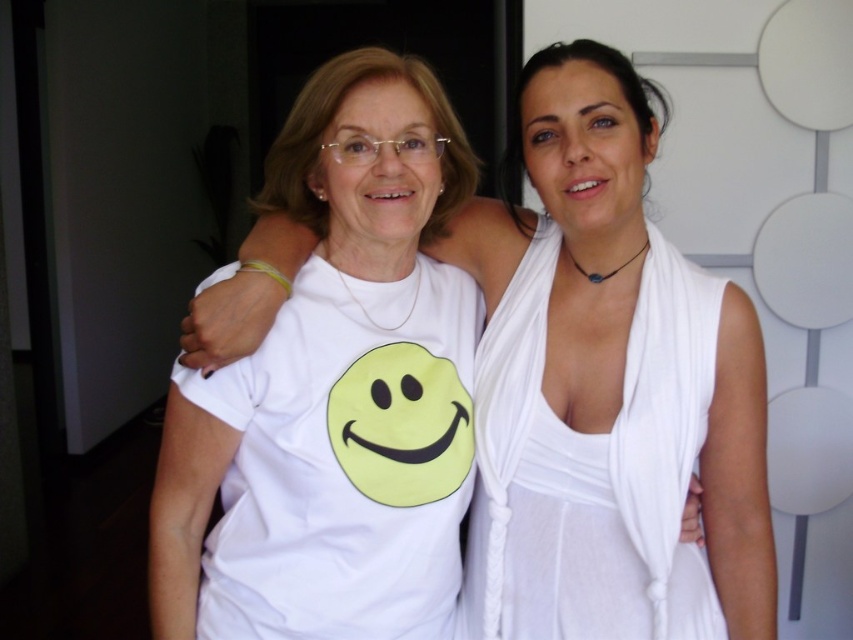
You are a photographer positioned in front of the two women. You want to take a photo that focuses on the white fabric dress at center and the white silky dress at center. Which dress will appear larger in the photo?

The white fabric dress at center will appear larger in the photo because it is closer to the viewer than the white silky dress at center.